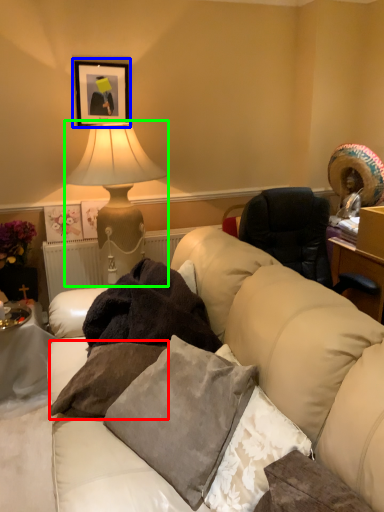
Question: Estimate the real-world distances between objects in this image. Which object is closer to pillow (highlighted by a red box), picture frame (highlighted by a blue box) or lamp (highlighted by a green box)?

Choices:
 (A) picture frame
 (B) lamp

Answer: (B)